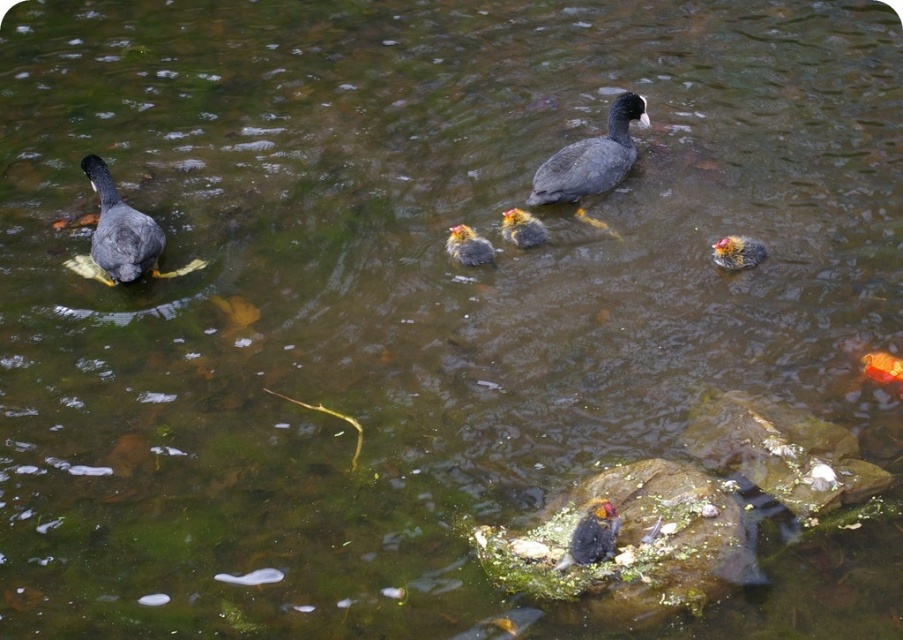
Question: Does matte gray duckling at left appear on the right side of brown fuzzy duckling at right?

Choices:
 (A) yes
 (B) no

Answer: (B)

Question: Estimate the real-world distances between objects in this image. Which object is farther from the yellow down feathers duckling at center?

Choices:
 (A) dark gray feathers at center
 (B) matte gray duckling at center

Answer: (A)

Question: Is brown fuzzy duckling at right further to the viewer compared to dark gray duckling at center?

Choices:
 (A) no
 (B) yes

Answer: (A)

Question: In this image, where is matte gray duckling at center located relative to dark gray feathers at center?

Choices:
 (A) left
 (B) right

Answer: (B)

Question: Which of the following is the closest to the observer?

Choices:
 (A) (118, 196)
 (B) (523, 221)
 (C) (612, 524)

Answer: (C)

Question: Which point is closer to the camera?

Choices:
 (A) yellow down feathers duckling at center
 (B) brown fuzzy duckling at right

Answer: (B)